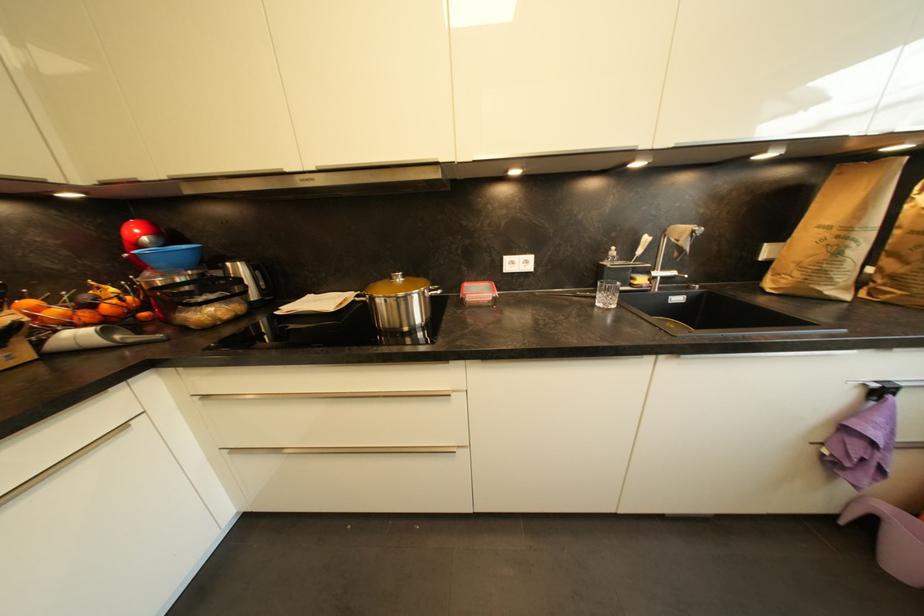
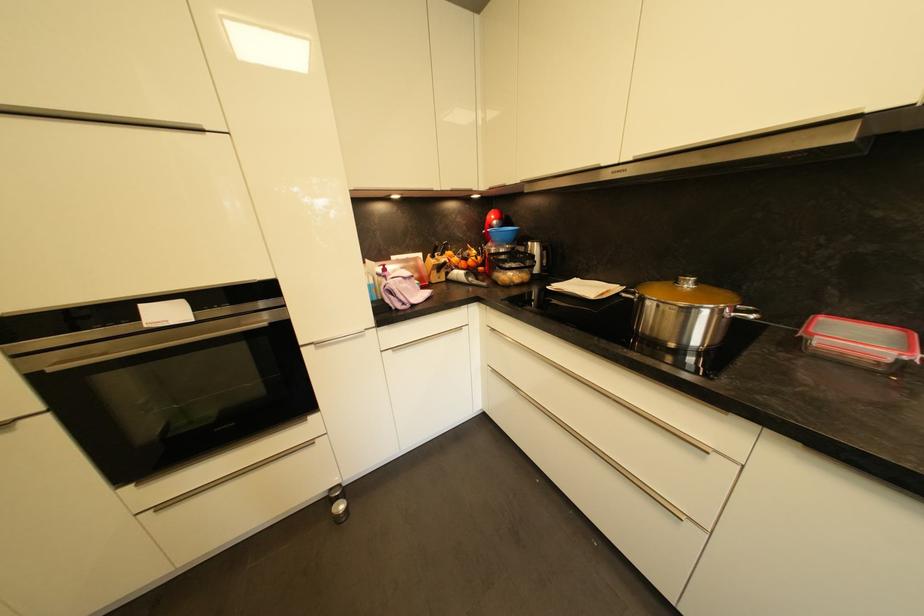
The point at (405, 281) is marked in the first image. Where is the corresponding point in the second image?

(694, 286)